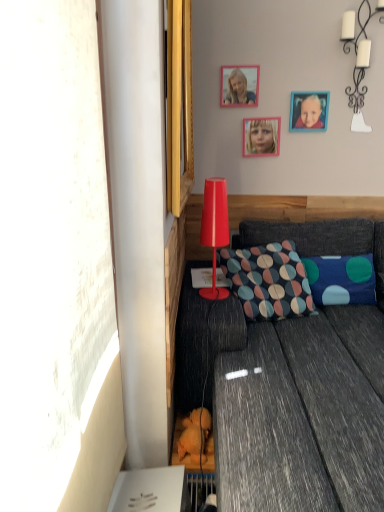
Question: Considering their positions, is wooden picture frame at upper center, which appears as the 1th picture frame when viewed from the left, located in front of or behind white ceramic candlestick at upper right, the 2th lamp from the bottom?

Choices:
 (A) behind
 (B) front

Answer: (A)

Question: From a real-world perspective, is wooden picture frame at upper center, which ranks as the 2th picture frame in right-to-left order, physically located above or below white ceramic candlestick at upper right, which is the 1th lamp from top to bottom?

Choices:
 (A) below
 (B) above

Answer: (A)

Question: Estimate the real-world distances between objects in this image. Which object is farther from the white ceramic candlestick at upper right, which ranks as the second lamp in front-to-back order?

Choices:
 (A) transparent glass window at left
 (B) multicolored fabric pillow at center, the second pillow from the right
 (C) wooden picture frame at upper right, positioned as the second picture frame in left-to-right order
 (D) matte plastic lamp at center, positioned as the 2th lamp in back-to-front order
 (E) matte pink frame at upper center

Answer: (A)

Question: Which is farther from the blue fabric pillow with colorful circles at lower right, acting as the 2th pillow starting from the left?

Choices:
 (A) wooden picture frame at upper center, which appears as the 1th picture frame when viewed from the left
 (B) multicolored fabric pillow at center, the second pillow from the right
 (C) white ceramic candlestick at upper right, arranged as the second lamp when viewed from the left
 (D) wooden picture frame at upper right, which is the first picture frame from right to left
 (E) transparent glass window at left

Answer: (E)